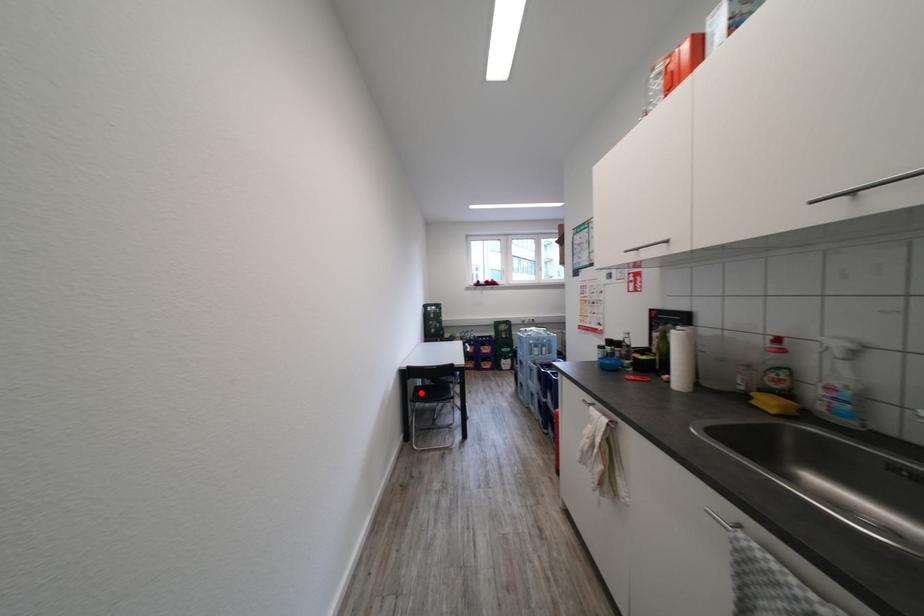
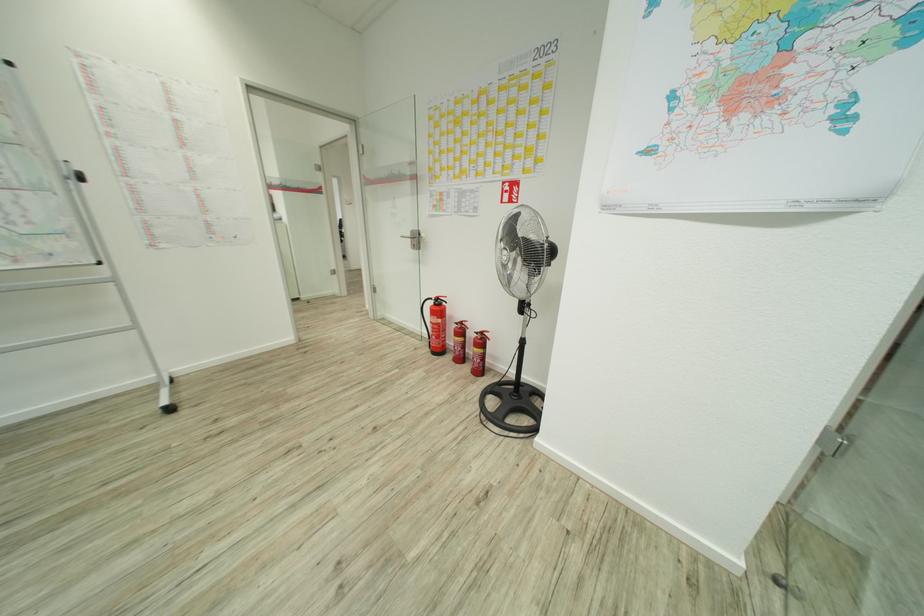
Question: I am providing you with two images of the same scene from different viewpoints. A red point is marked on the first image. Can you still see the location of the red point in image 2?

Choices:
 (A) Yes
 (B) No

Answer: (B)